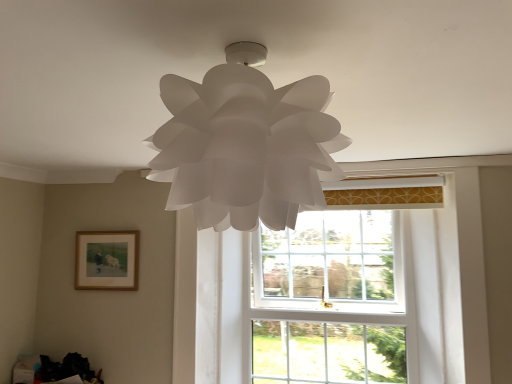
I want to click on wooden framed painting at lower left, so click(x=106, y=260).

Where is `wooden framed painting at lower left`? wooden framed painting at lower left is located at coordinates (106, 260).

Is wooden framed painting at lower left taller or shorter than white paper lamp at center?

Considering their sizes, wooden framed painting at lower left has less height than white paper lamp at center.

Are wooden framed painting at lower left and white paper lamp at center located far from each other?

wooden framed painting at lower left is positioned a significant distance from white paper lamp at center.

From the image's perspective, between wooden framed painting at lower left and white paper lamp at center, which one is located above?

white paper lamp at center appears higher in the image.

Is wooden framed painting at lower left to the left of white paper lamp at center from the viewer's perspective?

Correct, you'll find wooden framed painting at lower left to the left of white paper lamp at center.

Where is `picture frame located behind the white glass window at center`? picture frame located behind the white glass window at center is located at coordinates (106, 260).

Does wooden framed painting at lower left have a greater height compared to white glass window at center?

In fact, wooden framed painting at lower left may be shorter than white glass window at center.

Based on the photo, from a real-world perspective, between wooden framed painting at lower left and white glass window at center, who is vertically higher?

wooden framed painting at lower left, from a real-world perspective.

Is white paper lamp at center facing away from white glass window at center?

Yes.

Measure the distance between white paper lamp at center and white glass window at center.

They are 1.66 meters apart.

Is white paper lamp at center located outside white glass window at center?

Indeed, white paper lamp at center is completely outside white glass window at center.

Who is more distant, white paper lamp at center or white glass window at center?

white glass window at center is behind.

Can you confirm if white glass window at center is thinner than wooden framed painting at lower left?

No.

Considering the points (436, 337) and (80, 277), which point is in front, point (436, 337) or point (80, 277)?

Positioned in front is point (436, 337).

In the scene shown: Does white glass window at center have a lesser height compared to wooden framed painting at lower left?

In fact, white glass window at center may be taller than wooden framed painting at lower left.

From a real-world perspective, is white glass window at center above or below wooden framed painting at lower left?

white glass window at center is below wooden framed painting at lower left.

You are a GUI agent. You are given a task and a screenshot of the screen. Output one action in this format:
    pyautogui.click(x=<x>, y=<y>)
    Task: Click on the window below the white paper lamp at center (from a real-world perspective)
    
    Given the screenshot: What is the action you would take?
    pyautogui.click(x=336, y=298)

Between white glass window at center and white paper lamp at center, which one has more height?

white glass window at center is taller.

Between white glass window at center and white paper lamp at center, which one appears on the right side from the viewer's perspective?

From the viewer's perspective, white glass window at center appears more on the right side.

Relative to white paper lamp at center, is white glass window at center in front or behind?

white glass window at center is behind white paper lamp at center.

Are white paper lamp at center and wooden framed painting at lower left making contact?

white paper lamp at center is not next to wooden framed painting at lower left, and they're not touching.

Could wooden framed painting at lower left be considered to be inside white paper lamp at center?

No, white paper lamp at center does not contain wooden framed painting at lower left.

Relative to wooden framed painting at lower left, is white paper lamp at center in front or behind?

white paper lamp at center is in front of wooden framed painting at lower left.

In the image, there is a wooden framed painting at lower left. Where is `lamp above it (from the image's perspective)`? The image size is (512, 384). lamp above it (from the image's perspective) is located at coordinates (245, 144).

Image resolution: width=512 pixels, height=384 pixels. Identify the location of picture frame that appears behind the white glass window at center. (106, 260).

Looking at the image, which one is located closer to wooden framed painting at lower left, white paper lamp at center or white glass window at center?

white glass window at center.

When comparing their distances from white glass window at center, does white paper lamp at center or wooden framed painting at lower left seem closer?

wooden framed painting at lower left is positioned closer to the anchor white glass window at center.

Looking at the image, which one is located closer to white glass window at center, wooden framed painting at lower left or white paper lamp at center?

Based on the image, wooden framed painting at lower left appears to be nearer to white glass window at center.

Considering their positions, is white glass window at center positioned further to wooden framed painting at lower left than white paper lamp at center?

white paper lamp at center is positioned further to the anchor wooden framed painting at lower left.

Which object lies further to the anchor point white paper lamp at center, white glass window at center or wooden framed painting at lower left?

wooden framed painting at lower left is further to white paper lamp at center.

Considering their positions, is wooden framed painting at lower left positioned further to white paper lamp at center than white glass window at center?

Based on the image, wooden framed painting at lower left appears to be further to white paper lamp at center.

Locate an element on the screen. This screenshot has width=512, height=384. window between white paper lamp at center and wooden framed painting at lower left from front to back is located at coordinates (336, 298).